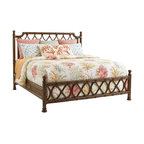
The height and width of the screenshot is (144, 144). I want to click on flower print comforter, so click(70, 63).